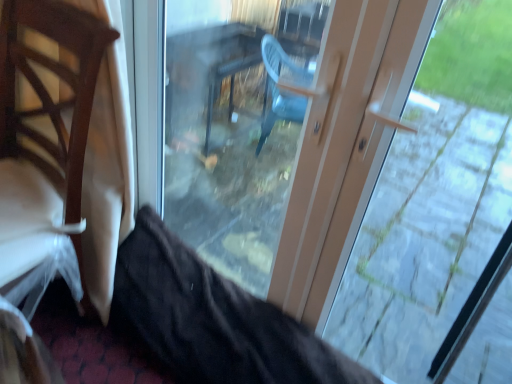
Question: Considering the positions of point (433, 109) and point (181, 74), is point (433, 109) closer or farther from the camera than point (181, 74)?

Choices:
 (A) farther
 (B) closer

Answer: (A)

Question: From a real-world perspective, is matte plastic door at center positioned above or below transparent glass door at center?

Choices:
 (A) below
 (B) above

Answer: (B)

Question: Considering the real-world distances, which object is closest to the transparent glass door at center?

Choices:
 (A) wooden chair at left
 (B) matte plastic door at center

Answer: (B)

Question: Considering the real-world distances, which object is farthest from the matte plastic door at center?

Choices:
 (A) transparent glass door at center
 (B) wooden chair at left

Answer: (B)